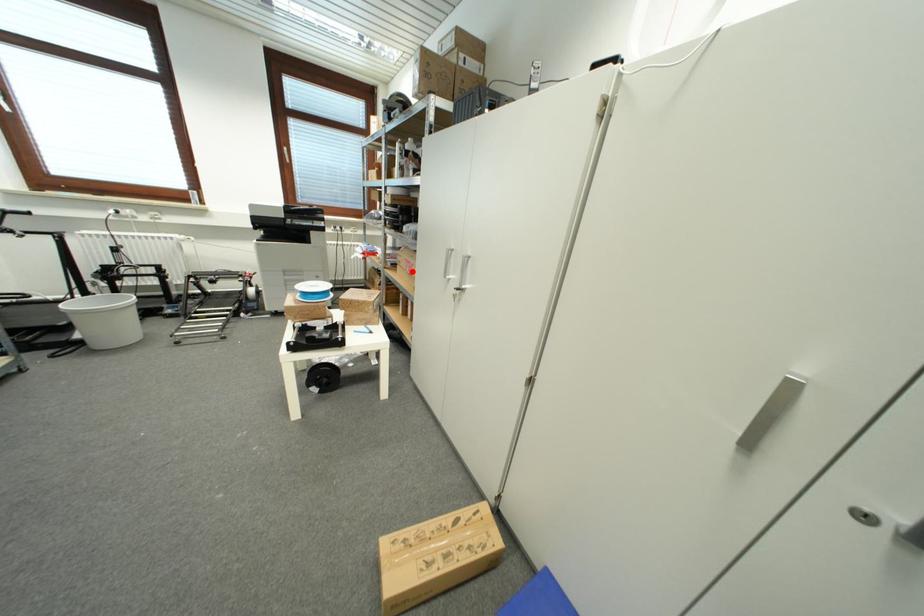
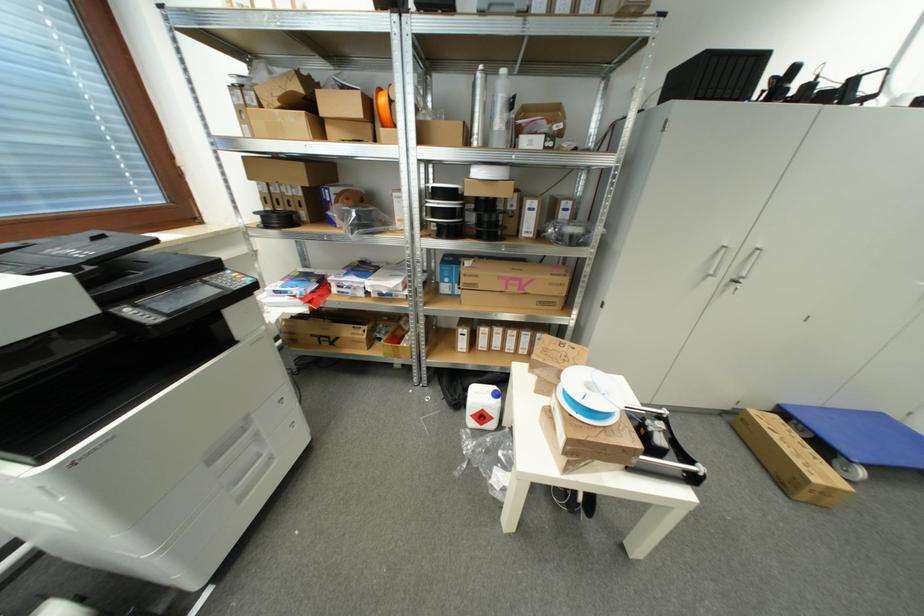
Find the pixel in the second image that matches the highlighted location in the first image.

(517, 292)